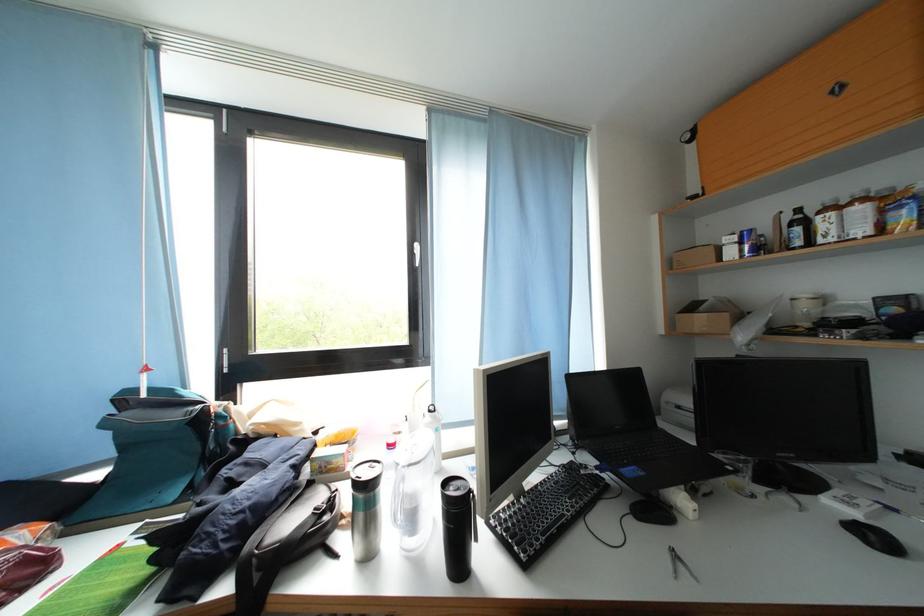
Find where to pull the white window handle. Please return your answer as a coordinate pair (x, y).

(417, 254)